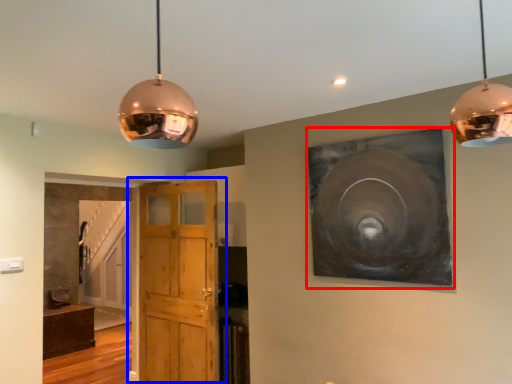
Question: Which object appears farthest to the camera in this image, picture frame (highlighted by a red box) or door (highlighted by a blue box)?

Choices:
 (A) picture frame
 (B) door

Answer: (B)